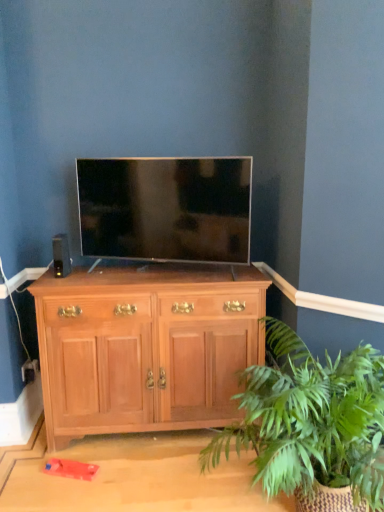
The height and width of the screenshot is (512, 384). What are the coordinates of `free space behind black matte speaker at left` in the screenshot? It's located at (67, 267).